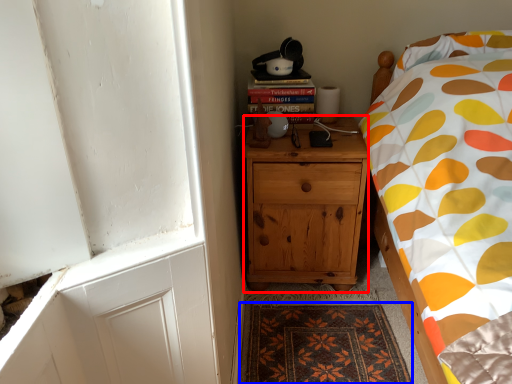
Question: Among these objects, which one is nearest to the camera, cabinetry (highlighted by a red box) or mat (highlighted by a blue box)?

Choices:
 (A) cabinetry
 (B) mat

Answer: (B)